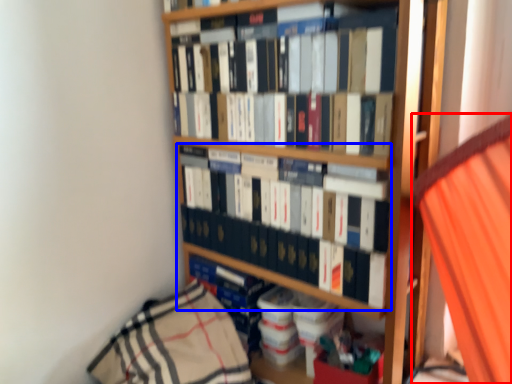
Question: Which point is further to the camera, curtain (highlighted by a red box) or book (highlighted by a blue box)?

Choices:
 (A) curtain
 (B) book

Answer: (B)